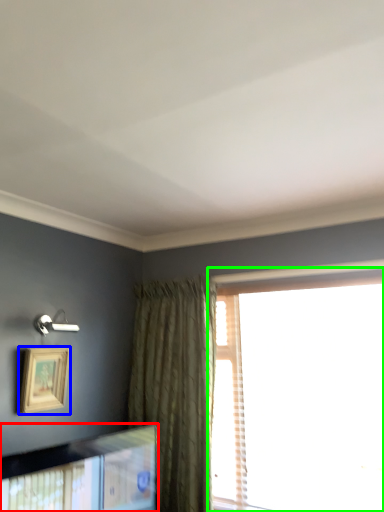
Question: Which is nearer to the picture frame (highlighted by a red box)? picture frame (highlighted by a blue box) or window (highlighted by a green box).

Choices:
 (A) picture frame
 (B) window

Answer: (A)